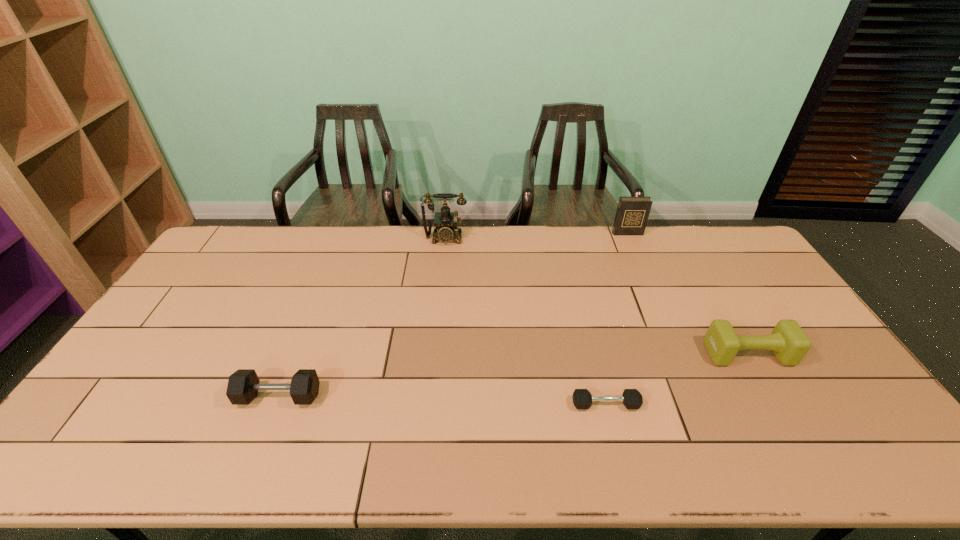
The width and height of the screenshot is (960, 540). Find the location of `blank region between the rightmost object and the fourth shortest object`. blank region between the rightmost object and the fourth shortest object is located at coordinates (687, 294).

Identify the location of free spot between the second object from right to left and the second dumbbell from right to left. The height and width of the screenshot is (540, 960). (616, 319).

Locate which object ranks third in proximity to the rightmost dumbbell. Please provide its 2D coordinates. Your answer should be formatted as a tuple, i.e. [(x, y)], where the tuple contains the x and y coordinates of a point satisfying the conditions above.

[(445, 221)]

What are the coordinates of `object that is the fourth nearest to the tallest object` in the screenshot? It's located at (789, 343).

Identify which dumbbell is located as the second nearest to the rightmost dumbbell. Please provide its 2D coordinates. Your answer should be formatted as a tuple, i.e. [(x, y)], where the tuple contains the x and y coordinates of a point satisfying the conditions above.

[(243, 385)]

Identify which dumbbell is the closest to the fourth object from left to right. Please provide its 2D coordinates. Your answer should be formatted as a tuple, i.e. [(x, y)], where the tuple contains the x and y coordinates of a point satisfying the conditions above.

[(789, 343)]

Locate an element on the screen. The width and height of the screenshot is (960, 540). vacant region that satisfies the following two spatial constraints: 1. on the rotary dial of the telephone; 2. on the left side of the farthest dumbbell is located at coordinates (434, 354).

Where is `free space that satisfies the following two spatial constraints: 1. on the rotary dial of the rightmost object; 2. on the left side of the fourth object from right to left`? Image resolution: width=960 pixels, height=540 pixels. free space that satisfies the following two spatial constraints: 1. on the rotary dial of the rightmost object; 2. on the left side of the fourth object from right to left is located at coordinates (434, 354).

Locate an element on the screen. The image size is (960, 540). blank area in the image that satisfies the following two spatial constraints: 1. on the front cover of the fourth object from left to right; 2. on the right side of the rightmost dumbbell is located at coordinates (680, 354).

The width and height of the screenshot is (960, 540). Find the location of `vacant space that satisfies the following two spatial constraints: 1. on the rotary dial of the third object from left to right; 2. on the right side of the second object from left to right`. vacant space that satisfies the following two spatial constraints: 1. on the rotary dial of the third object from left to right; 2. on the right side of the second object from left to right is located at coordinates (429, 404).